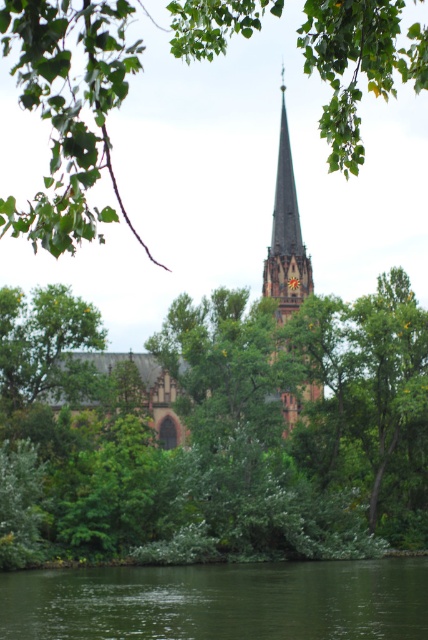
You are standing at the riverside and want to take a photo of the green leafy tree at center and the green smooth water at lower center. Which object will appear closer to you in the photo?

The green leafy tree at center will appear closer to you in the photo because it is closer to the viewer than the green smooth water at lower center.

Based on the photo, you are standing on the riverside path and see the green leafy tree at center and the green smooth water at lower center. Which object is closer to you?

The green smooth water at lower center is closer to you because it is positioned below the green leafy tree at center.